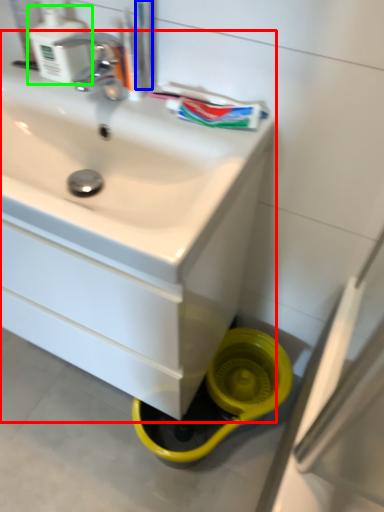
Question: Which object is the closest to the sink (highlighted by a red box)? Choose among these: toothbrush (highlighted by a blue box) or soap dispenser (highlighted by a green box).

Choices:
 (A) toothbrush
 (B) soap dispenser

Answer: (B)